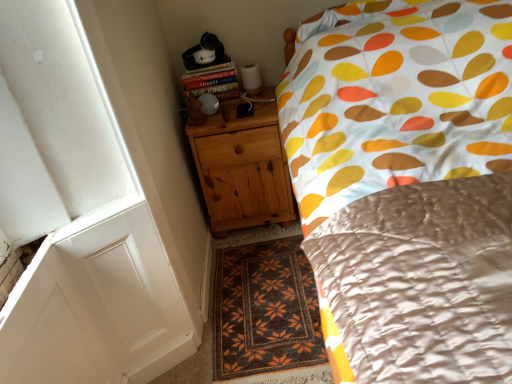
Question: Does brown woven rug at center have a smaller size compared to hardcover book at upper left?

Choices:
 (A) no
 (B) yes

Answer: (A)

Question: Is hardcover book at upper left at the back of brown woven rug at center?

Choices:
 (A) no
 (B) yes

Answer: (A)

Question: Is brown woven rug at center not inside hardcover book at upper left?

Choices:
 (A) no
 (B) yes

Answer: (B)

Question: Is brown woven rug at center aimed at hardcover book at upper left?

Choices:
 (A) yes
 (B) no

Answer: (B)

Question: From a real-world perspective, is brown woven rug at center under hardcover book at upper left?

Choices:
 (A) no
 (B) yes

Answer: (B)

Question: Does brown woven rug at center have a greater height compared to hardcover book at upper left?

Choices:
 (A) yes
 (B) no

Answer: (B)

Question: Does hardcover book at upper left have a greater height compared to natural wood chest of drawers at lower left?

Choices:
 (A) no
 (B) yes

Answer: (A)

Question: From a real-world perspective, is hardcover book at upper left on top of natural wood chest of drawers at lower left?

Choices:
 (A) no
 (B) yes

Answer: (B)

Question: Is hardcover book at upper left in front of natural wood chest of drawers at lower left?

Choices:
 (A) no
 (B) yes

Answer: (A)

Question: From the image's perspective, would you say hardcover book at upper left is positioned over natural wood chest of drawers at lower left?

Choices:
 (A) no
 (B) yes

Answer: (B)

Question: Is hardcover book at upper left wider than natural wood chest of drawers at lower left?

Choices:
 (A) no
 (B) yes

Answer: (A)

Question: Can you confirm if hardcover book at upper left is positioned to the left of natural wood chest of drawers at lower left?

Choices:
 (A) no
 (B) yes

Answer: (B)

Question: From the image's perspective, is natural wood chest of drawers at lower left above brown woven rug at center?

Choices:
 (A) no
 (B) yes

Answer: (B)